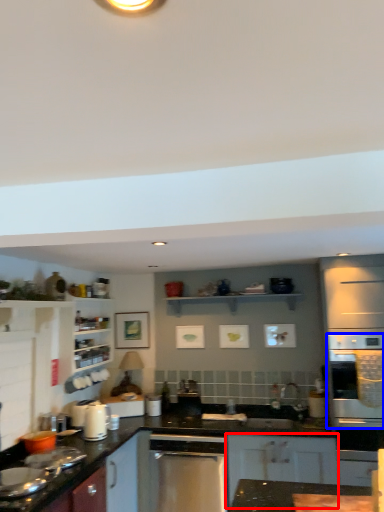
Question: Among these objects, which one is farthest to the camera, cabinetry (highlighted by a red box) or oven (highlighted by a blue box)?

Choices:
 (A) cabinetry
 (B) oven

Answer: (A)